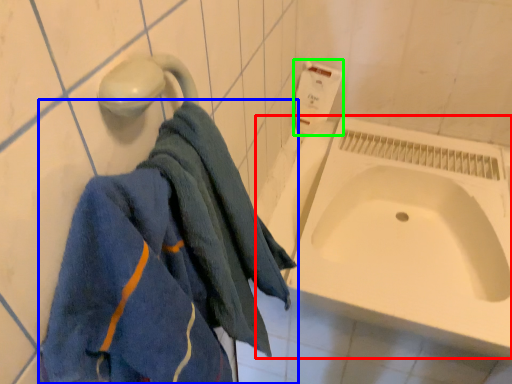
Question: Based on their relative distances, which object is nearer to bath (highlighted by a red box)? Choose from towel (highlighted by a blue box) and toilet paper (highlighted by a green box).

Choices:
 (A) towel
 (B) toilet paper

Answer: (B)